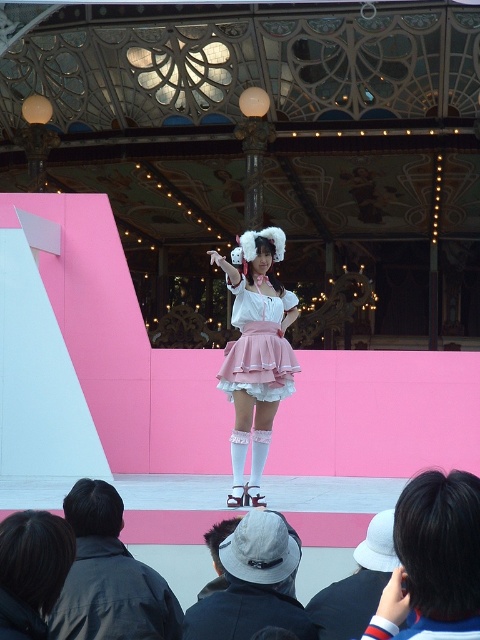
Does matte pink skirt at center appear under gray felt hat at lower center?

Incorrect, matte pink skirt at center is not positioned below gray felt hat at lower center.

Looking at this image, who is positioned more to the left, matte pink skirt at center or gray felt hat at lower center?

matte pink skirt at center is more to the left.

Between point (288, 374) and point (256, 563), which one is positioned behind?

The point (288, 374) is behind.

Where is `matte pink skirt at center`? matte pink skirt at center is located at coordinates pos(255,353).

Does pink satin skirt at center have a smaller size compared to white cotton hat at lower center?

Yes.

Between point (228, 381) and point (368, 602), which one is positioned behind?

Point (228, 381)

The image size is (480, 640). Identify the location of pink satin skirt at center. (259, 346).

This screenshot has width=480, height=640. In order to click on pink satin skirt at center in this screenshot , I will do `click(259, 346)`.

Is the position of black fabric jacket at lower left more distant than that of gray felt hat at lower center?

That is True.

Is black fabric jacket at lower left positioned before gray felt hat at lower center?

No, it is behind gray felt hat at lower center.

Locate an element on the screen. black fabric jacket at lower left is located at coordinates (108, 577).